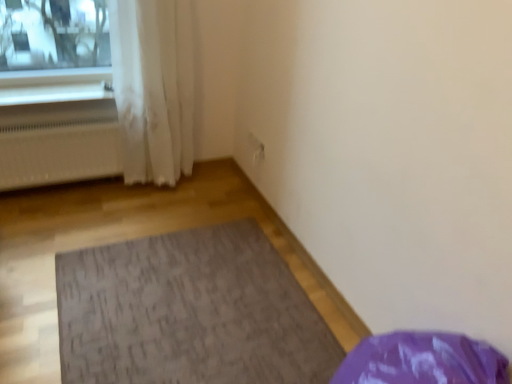
Question: Can you confirm if white sheer curtain at left is taller than white matte radiator at left?

Choices:
 (A) yes
 (B) no

Answer: (A)

Question: Is white sheer curtain at left far from white matte radiator at left?

Choices:
 (A) no
 (B) yes

Answer: (A)

Question: Does white sheer curtain at left touch white matte radiator at left?

Choices:
 (A) no
 (B) yes

Answer: (A)

Question: Considering the relative sizes of white sheer curtain at left and white matte radiator at left in the image provided, is white sheer curtain at left smaller than white matte radiator at left?

Choices:
 (A) yes
 (B) no

Answer: (B)

Question: Is white sheer curtain at left bigger than white matte radiator at left?

Choices:
 (A) yes
 (B) no

Answer: (A)

Question: Is white sheer curtain at left spatially inside white matte radiator at left, or outside of it?

Choices:
 (A) outside
 (B) inside

Answer: (A)

Question: In terms of width, does white sheer curtain at left look wider or thinner when compared to white matte radiator at left?

Choices:
 (A) thin
 (B) wide

Answer: (B)

Question: From a real-world perspective, is white sheer curtain at left physically located above or below white matte radiator at left?

Choices:
 (A) below
 (B) above

Answer: (B)

Question: In terms of height, does white sheer curtain at left look taller or shorter compared to white matte radiator at left?

Choices:
 (A) short
 (B) tall

Answer: (B)

Question: In terms of width, does textured gray mat at center look wider or thinner when compared to white matte radiator at left?

Choices:
 (A) wide
 (B) thin

Answer: (A)

Question: From a real-world perspective, is textured gray mat at center above or below white matte radiator at left?

Choices:
 (A) above
 (B) below

Answer: (B)

Question: Choose the correct answer: Is textured gray mat at center inside white matte radiator at left or outside it?

Choices:
 (A) outside
 (B) inside

Answer: (A)

Question: Does point (108, 284) appear closer or farther from the camera than point (69, 127)?

Choices:
 (A) closer
 (B) farther

Answer: (A)

Question: In terms of height, does white matte radiator at left look taller or shorter compared to white plastic window sill at upper left?

Choices:
 (A) short
 (B) tall

Answer: (B)

Question: Does point pos(59,125) appear closer or farther from the camera than point pos(57,92)?

Choices:
 (A) closer
 (B) farther

Answer: (A)